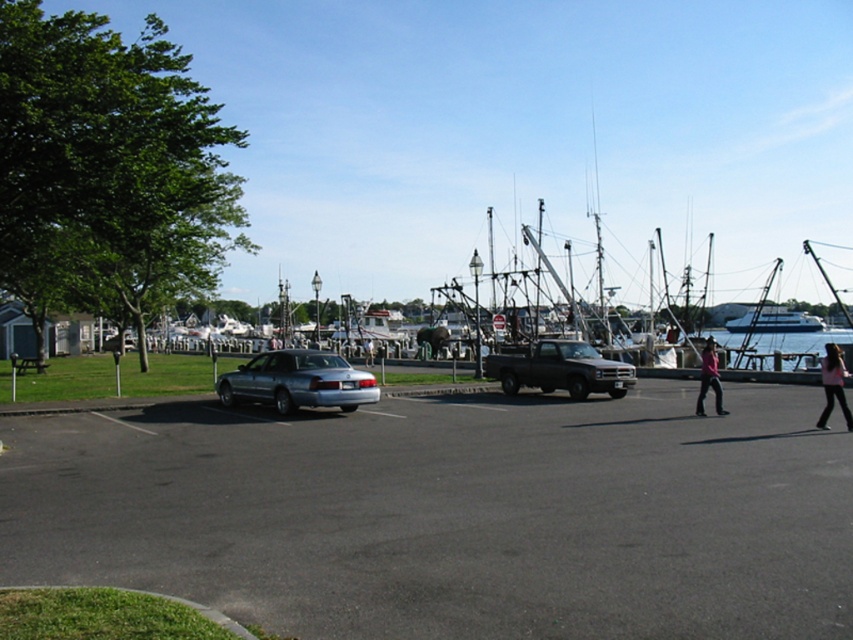
How distant is satin silver sedan at center from pink fabric pants at lower right?

satin silver sedan at center and pink fabric pants at lower right are 12.93 meters apart.

Looking at this image, does satin silver sedan at center have a greater width compared to pink fabric pants at lower right?

No, satin silver sedan at center is not wider than pink fabric pants at lower right.

Locate an element on the screen. Image resolution: width=853 pixels, height=640 pixels. satin silver sedan at center is located at coordinates (299, 381).

Does gray asphalt parking lot at center lie behind pink fabric pants at right?

No, gray asphalt parking lot at center is in front of pink fabric pants at right.

Can you confirm if gray asphalt parking lot at center is wider than pink fabric pants at right?

Yes, gray asphalt parking lot at center is wider than pink fabric pants at right.

Which is in front, point (38, 554) or point (705, 387)?

Point (38, 554) is more forward.

The height and width of the screenshot is (640, 853). Find the location of `gray asphalt parking lot at center`. gray asphalt parking lot at center is located at coordinates (451, 513).

In the scene shown: Is gray asphalt parking lot at center wider than satin silver sedan at center?

Yes.

Is gray asphalt parking lot at center above satin silver sedan at center?

Actually, gray asphalt parking lot at center is below satin silver sedan at center.

The image size is (853, 640). Find the location of `gray asphalt parking lot at center`. gray asphalt parking lot at center is located at coordinates (451, 513).

Where is `gray asphalt parking lot at center`? The image size is (853, 640). gray asphalt parking lot at center is located at coordinates (451, 513).